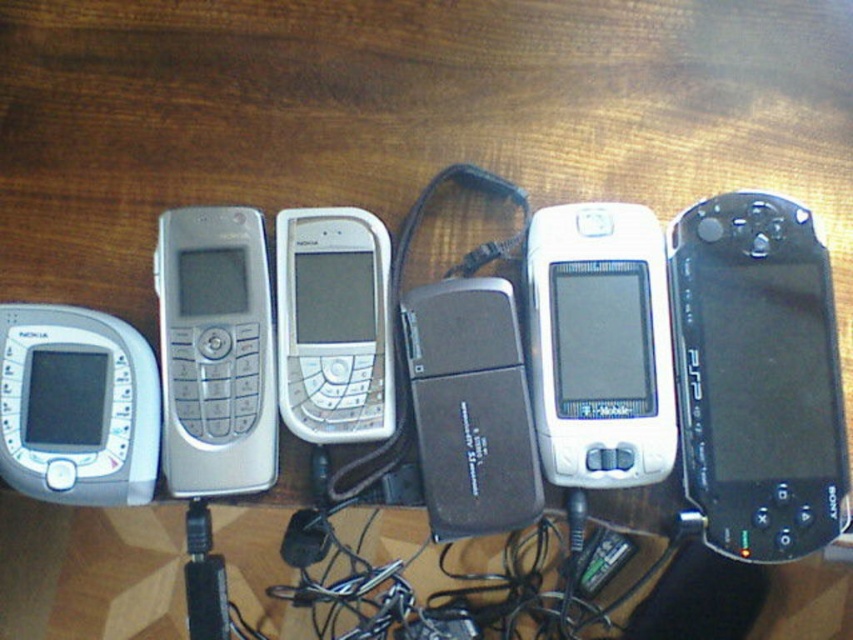
Question: Is black matte psp at right positioned before silver metallic phone at center-left?

Choices:
 (A) no
 (B) yes

Answer: (B)

Question: Can you confirm if black plastic usb drive at center is smaller than white matte phone at center?

Choices:
 (A) no
 (B) yes

Answer: (A)

Question: Which of the following is the farthest from the observer?

Choices:
 (A) [x=323, y=260]
 (B) [x=544, y=456]
 (C) [x=778, y=380]

Answer: (A)

Question: Which is nearer to the silver metallic phone at center?

Choices:
 (A) white matte phone at center
 (B) black plastic usb drive at center
 (C) black matte psp at right
 (D) silver metallic phone at center-left

Answer: (B)

Question: Which of the following is the farthest from the observer?

Choices:
 (A) silver metallic phone at center
 (B) white matte phone at center

Answer: (B)

Question: Is silver metallic phone at center-left to the left of white matte phone at center from the viewer's perspective?

Choices:
 (A) no
 (B) yes

Answer: (B)